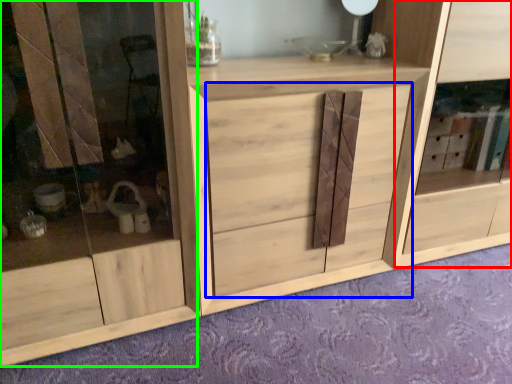
Question: Estimate the real-world distances between objects in this image. Which object is closer to cabinet (highlighted by a red box), drawer (highlighted by a blue box) or screen door (highlighted by a green box)?

Choices:
 (A) drawer
 (B) screen door

Answer: (A)